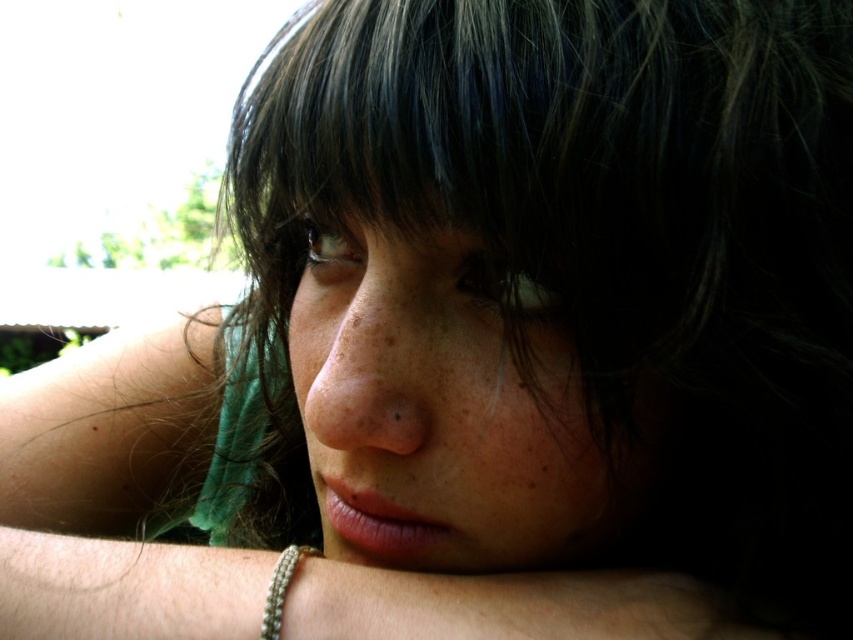
You are an artist sketching this scene. You want to draw the smooth silver bracelet at lower center precisely. What are the coordinates of its position in the image?

The smooth silver bracelet at lower center is located at coordinates (x=494, y=605).

Based on the scene description, can you determine if the smooth skin face at center is wider than the silver metallic bracelet at lower left?

The smooth skin face at center is wider than the silver metallic bracelet at lower left according to the description.